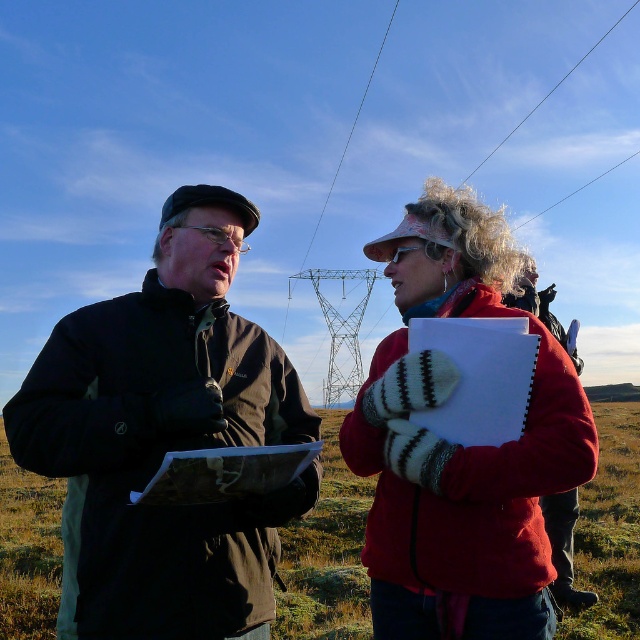
Where is `dark brown jacket at center`? dark brown jacket at center is located at coordinates (168, 433).

Does dark brown jacket at center appear on the right side of red woolen mittens at center?

No, dark brown jacket at center is not to the right of red woolen mittens at center.

At what (x,y) coordinates should I click in order to perform the action: click on dark brown jacket at center. Please return your answer as a coordinate pair (x, y). The height and width of the screenshot is (640, 640). Looking at the image, I should click on (168, 433).

Identify the location of dark brown jacket at center. (168, 433).